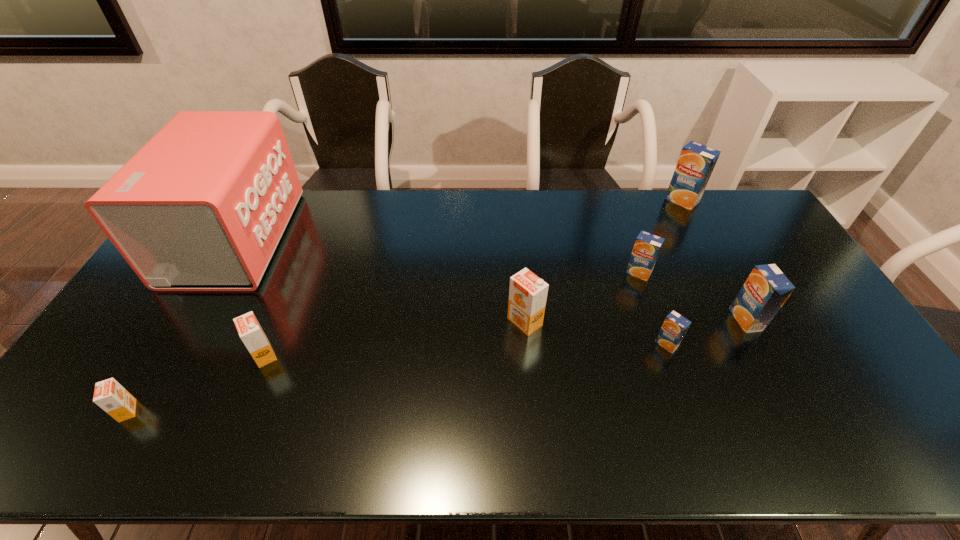
The height and width of the screenshot is (540, 960). What are the coordinates of `vacant area that lies between the tallest orange juice and the second biggest orange orange juice` in the screenshot? It's located at (473, 278).

Image resolution: width=960 pixels, height=540 pixels. What are the coordinates of `empty space that is in between the pink box and the nearest blue orange_juice` in the screenshot? It's located at (451, 291).

The width and height of the screenshot is (960, 540). I want to click on vacant space that is in between the third farthest blue orange_juice and the smallest blue orange_juice, so click(707, 332).

Where is `vacant point located between the nearest blue orange_juice and the second farthest blue orange_juice`? The image size is (960, 540). vacant point located between the nearest blue orange_juice and the second farthest blue orange_juice is located at coordinates pos(653,308).

Locate an element on the screen. This screenshot has width=960, height=540. empty space that is in between the tallest object and the sixth nearest orange juice is located at coordinates (437, 255).

Where is `vacant area that lies between the nearest orange orange juice and the farthest orange juice`? This screenshot has height=540, width=960. vacant area that lies between the nearest orange orange juice and the farthest orange juice is located at coordinates (405, 306).

The height and width of the screenshot is (540, 960). Find the location of `vacant region between the smallest orange orange juice and the second orange orange juice from left to right`. vacant region between the smallest orange orange juice and the second orange orange juice from left to right is located at coordinates (196, 383).

At what (x,y) coordinates should I click in order to perform the action: click on free point between the tallest orange juice and the nearest orange juice. Please return your answer as a coordinate pair (x, y). Looking at the image, I should click on (405, 306).

At what (x,y) coordinates should I click in order to perform the action: click on free spot between the second orange orange juice from right to left and the second nearest blue orange_juice. Please return your answer as a coordinate pair (x, y). Looking at the image, I should click on (505, 338).

Point out which object is positioned as the second nearest to the leftmost orange juice. Please provide its 2D coordinates. Your answer should be formatted as a tuple, i.e. [(x, y)], where the tuple contains the x and y coordinates of a point satisfying the conditions above.

[(202, 206)]